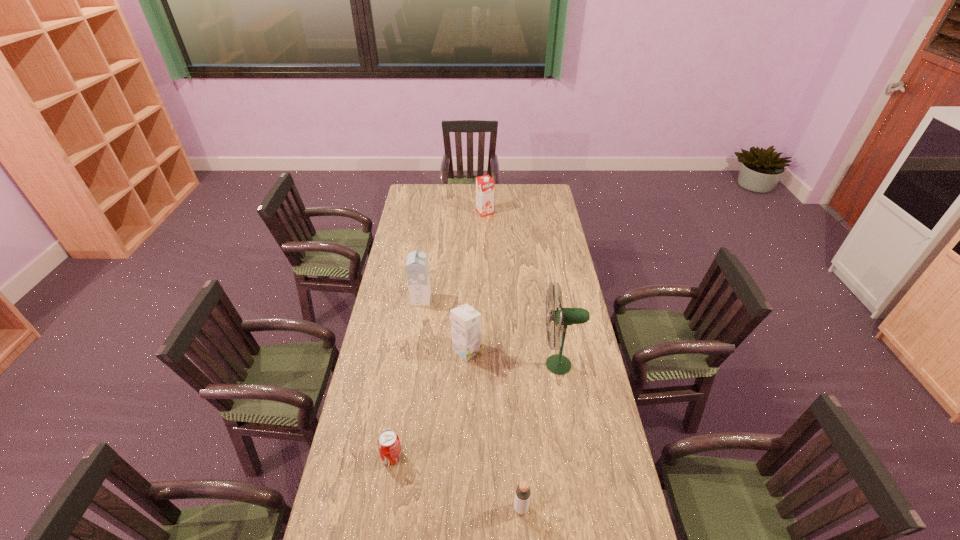
The height and width of the screenshot is (540, 960). I want to click on free space that satisfies the following two spatial constraints: 1. on the back side of the nearest carton; 2. on the left side of the farthest object, so click(x=470, y=213).

In order to click on vacant region that satisfies the following two spatial constraints: 1. on the back side of the nearest carton; 2. on the front label of the second farthest object in this screenshot , I will do `click(468, 299)`.

At what (x,y) coordinates should I click in order to perform the action: click on vacant space that satisfies the following two spatial constraints: 1. on the front label of the nearest carton; 2. on the right side of the second farthest carton. Please return your answer as a coordinate pair (x, y). Looking at the image, I should click on (414, 350).

At what (x,y) coordinates should I click in order to perform the action: click on vacant region that satisfies the following two spatial constraints: 1. on the back side of the nearest carton; 2. on the right side of the farthest object. Please return your answer as a coordinate pair (x, y). Looking at the image, I should click on (470, 213).